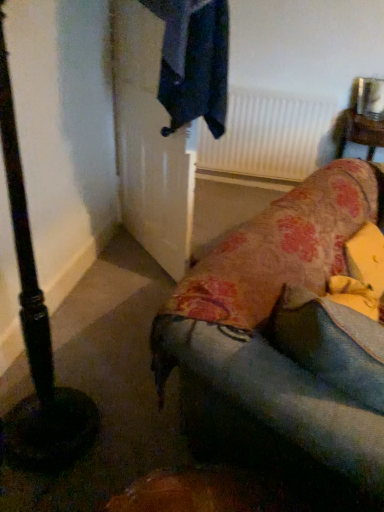
Question: Is floral fabric studio couch at lower right not within wooden table at upper right?

Choices:
 (A) no
 (B) yes

Answer: (B)

Question: Is floral fabric studio couch at lower right shorter than wooden table at upper right?

Choices:
 (A) yes
 (B) no

Answer: (B)

Question: Does floral fabric studio couch at lower right have a greater width compared to wooden table at upper right?

Choices:
 (A) yes
 (B) no

Answer: (A)

Question: Can you confirm if floral fabric studio couch at lower right is bigger than wooden table at upper right?

Choices:
 (A) yes
 (B) no

Answer: (A)

Question: From a real-world perspective, does floral fabric studio couch at lower right sit lower than wooden table at upper right?

Choices:
 (A) no
 (B) yes

Answer: (A)

Question: From the image's perspective, is floral fabric studio couch at lower right on wooden table at upper right?

Choices:
 (A) yes
 (B) no

Answer: (B)

Question: Can you confirm if floral fabric studio couch at lower right is taller than black matte pole at left?

Choices:
 (A) no
 (B) yes

Answer: (A)

Question: Is floral fabric studio couch at lower right turned away from black matte pole at left?

Choices:
 (A) no
 (B) yes

Answer: (A)

Question: From the image's perspective, is floral fabric studio couch at lower right located beneath black matte pole at left?

Choices:
 (A) no
 (B) yes

Answer: (B)

Question: Considering the relative sizes of floral fabric studio couch at lower right and black matte pole at left in the image provided, is floral fabric studio couch at lower right bigger than black matte pole at left?

Choices:
 (A) no
 (B) yes

Answer: (A)

Question: From the image's perspective, does floral fabric studio couch at lower right appear higher than black matte pole at left?

Choices:
 (A) no
 (B) yes

Answer: (A)

Question: Is floral fabric studio couch at lower right next to black matte pole at left and touching it?

Choices:
 (A) yes
 (B) no

Answer: (B)

Question: Could white matte radiator at upper center be considered to be inside black matte pole at left?

Choices:
 (A) no
 (B) yes

Answer: (A)